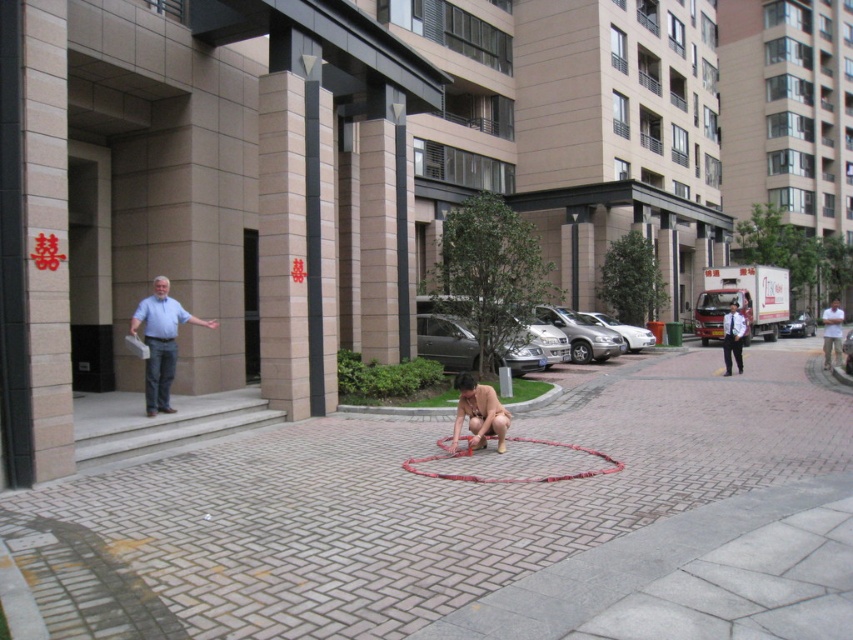
You are standing at the entrance of the modern building and want to take a photo of the red Chinese characters displayed on the wall. You need to position yourself so that you are exactly 20 feet away from the point marked at coordinates [604,516]. Is your current position sufficient to capture the characters clearly in the frame?

The point at coordinates [604,516] is 19.66 feet from the camera, which is slightly less than 20 feet. Therefore, you are close enough to capture the red Chinese characters clearly in the frame.

You are a photographer trying to capture the scene of the woman tying a red rope. You want to ensure the light blue shirt at center and the brick pavement at center are both visible in the shot. Which object should you focus on first to ensure both are in frame?

The brick pavement at center is positioned under the light blue shirt at center. To ensure both are in frame, focus on the light blue shirt at center first as it is above the brick pavement, allowing the pavement to naturally come into view below.